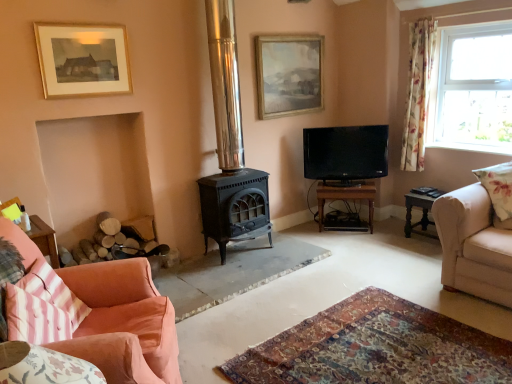
Where is `vacant area to the right of black cast iron stove at center`? The image size is (512, 384). vacant area to the right of black cast iron stove at center is located at coordinates (300, 246).